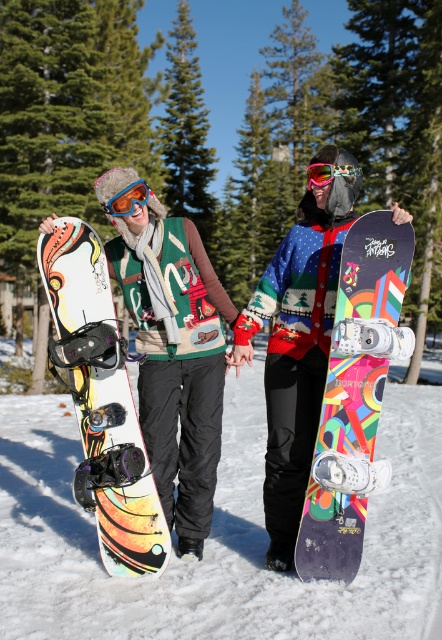
Question: Which object is closer to the camera taking this photo?

Choices:
 (A) green textured pine trees at upper center
 (B) matte black snowboard at center
 (C) multicolored glossy snowboard at center

Answer: (B)

Question: Which point is closer to the camera taking this photo?

Choices:
 (A) (126, 209)
 (B) (122, 508)

Answer: (B)

Question: In this image, where is multicolored glossy snowboard at center located relative to matte blue goggles at upper left?

Choices:
 (A) right
 (B) left

Answer: (A)

Question: In this image, where is matte snowboard at left located relative to multicolored glossy snowboard at center?

Choices:
 (A) left
 (B) right

Answer: (A)

Question: Is green textured pine trees at upper center to the left of multicolored glossy snowboard at center from the viewer's perspective?

Choices:
 (A) yes
 (B) no

Answer: (B)

Question: Which is nearer to the green textured pine trees at upper center?

Choices:
 (A) matte multicolored snowboard at left
 (B) multicolored glossy snowboard at center
 (C) matte black snowboard at center

Answer: (C)